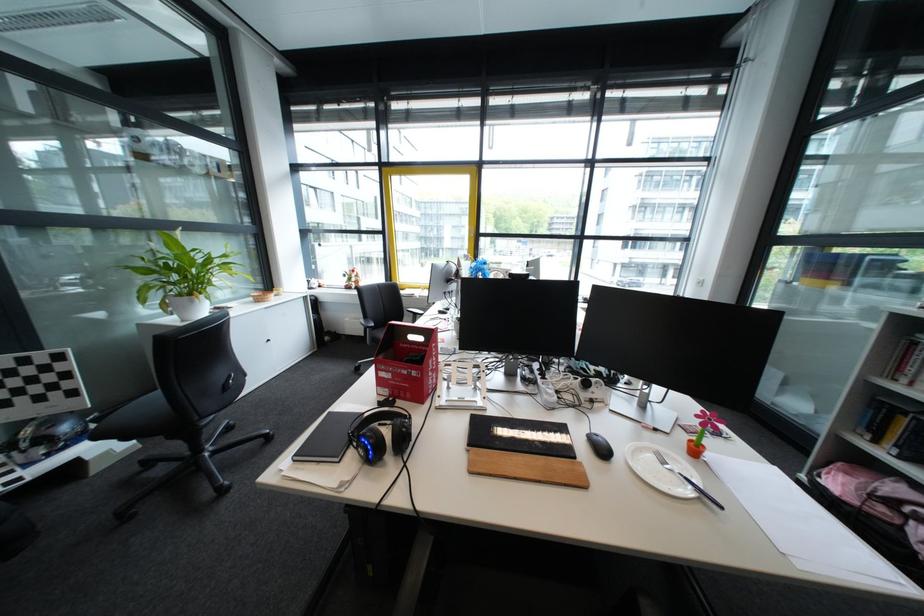
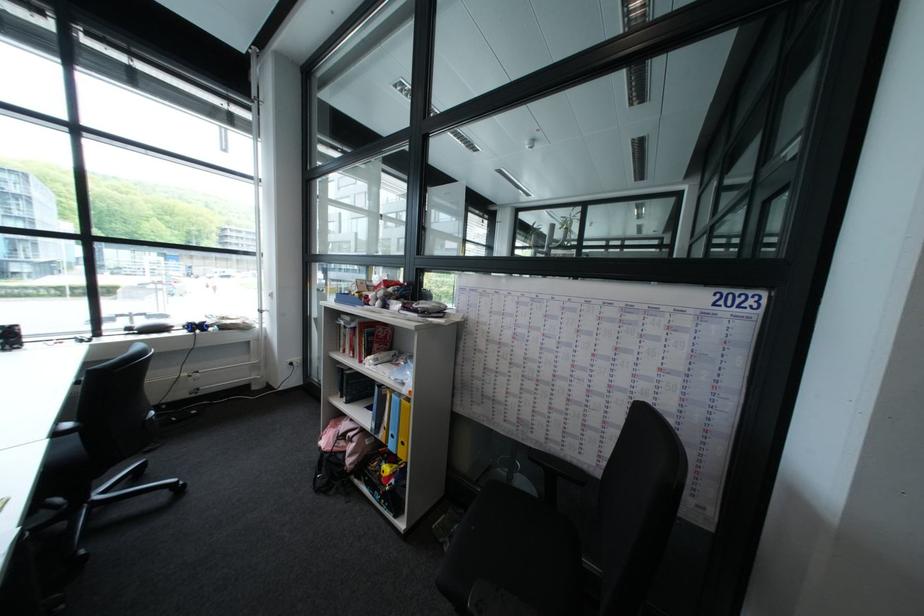
Find the pixel in the second image that matches [860,474] in the first image.

(348, 428)